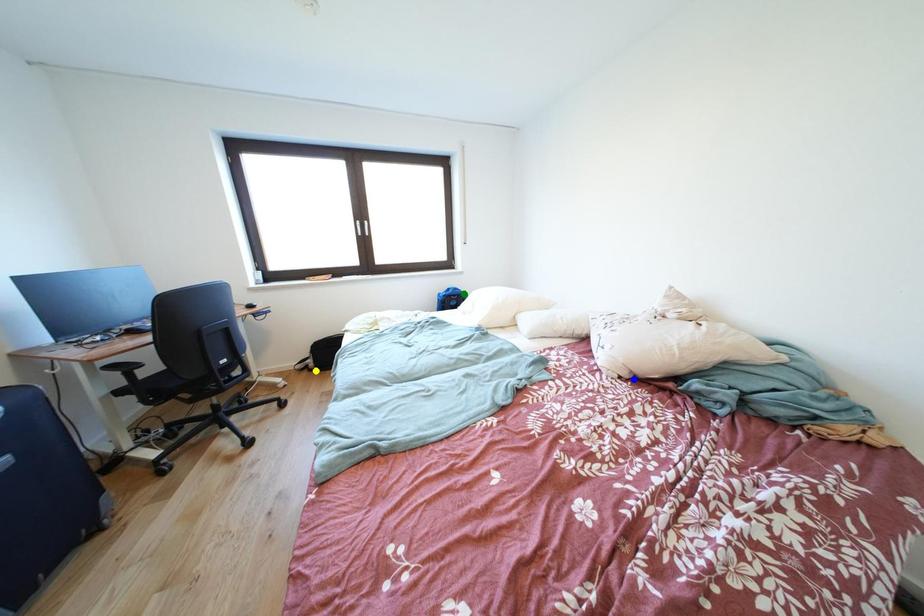
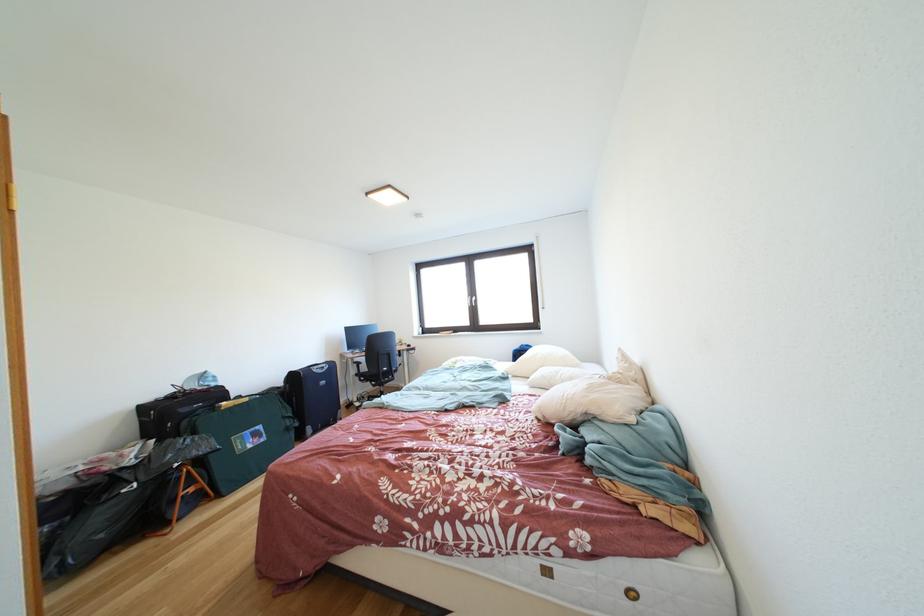
I am providing you with two images of the same scene from different viewpoints. Three points are marked in image1. Which point corresponds to a part or object that is occluded in image2?In image1, three points are marked. Which of them correspond to a part or object that is occluded in image2?Among the three points shown in image1, which one corresponds to a part or object that is no longer visible due to occlusion in image2?

yellow point cannot be seen in image2.